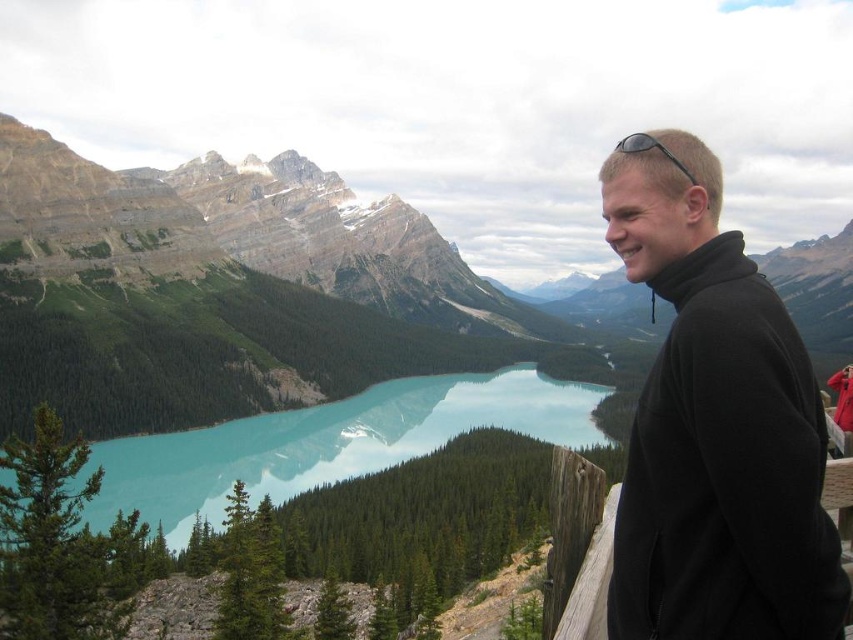
Question: Which object is closer to the camera taking this photo?

Choices:
 (A) turquoise glossy water at center
 (B) black rubber sunglasses at upper right

Answer: (B)

Question: Which of the following is the farthest from the observer?

Choices:
 (A) turquoise glossy water at center
 (B) black fleece jacket at right
 (C) black rubber sunglasses at upper right

Answer: (A)

Question: Is black fleece jacket at right behind turquoise glossy water at center?

Choices:
 (A) yes
 (B) no

Answer: (B)

Question: Estimate the real-world distances between objects in this image. Which object is farther from the black rubber sunglasses at upper right?

Choices:
 (A) black fleece jacket at right
 (B) turquoise glossy water at center

Answer: (B)

Question: Does turquoise glossy water at center appear on the left side of black rubber sunglasses at upper right?

Choices:
 (A) yes
 (B) no

Answer: (A)

Question: Can you confirm if black fleece jacket at right is positioned to the right of turquoise glossy water at center?

Choices:
 (A) yes
 (B) no

Answer: (A)